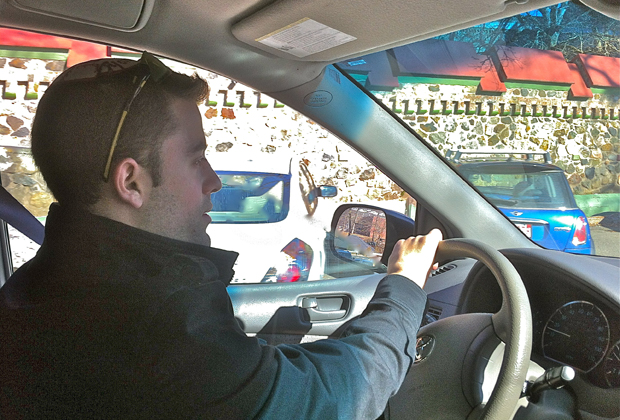
Locate an element on the screen. This screenshot has width=620, height=420. wall is located at coordinates (569, 112).